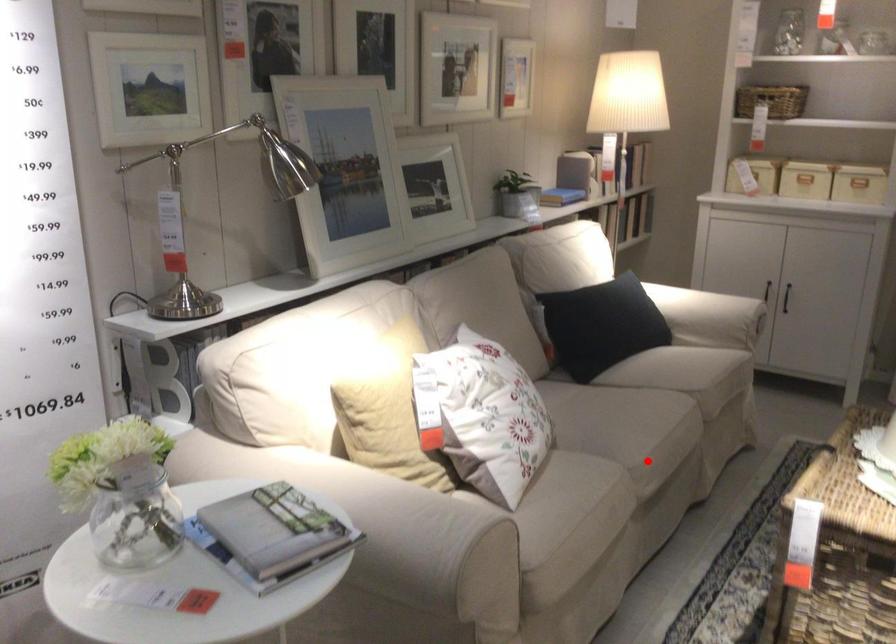
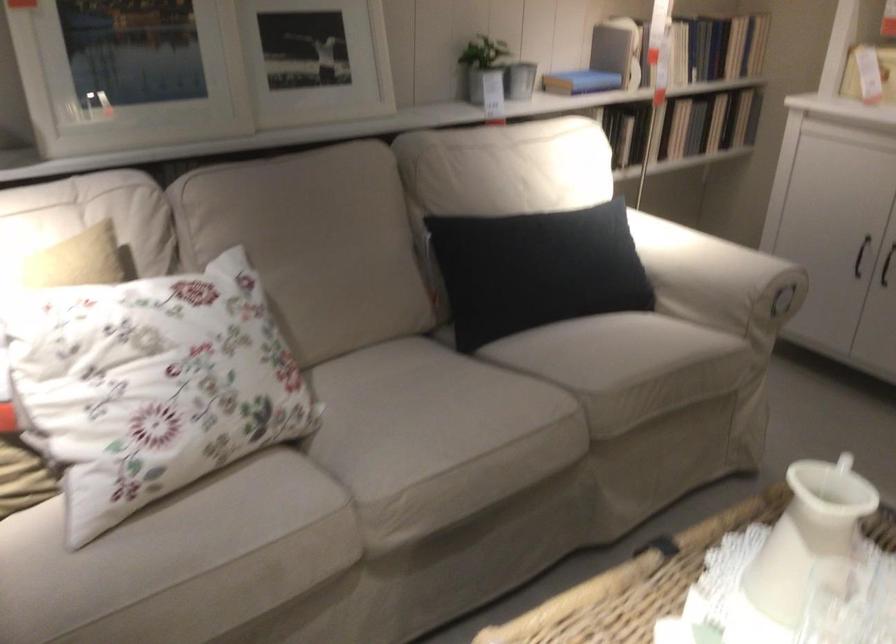
Where in the second image is the point corresponding to the highlighted location from the first image?

(398, 494)